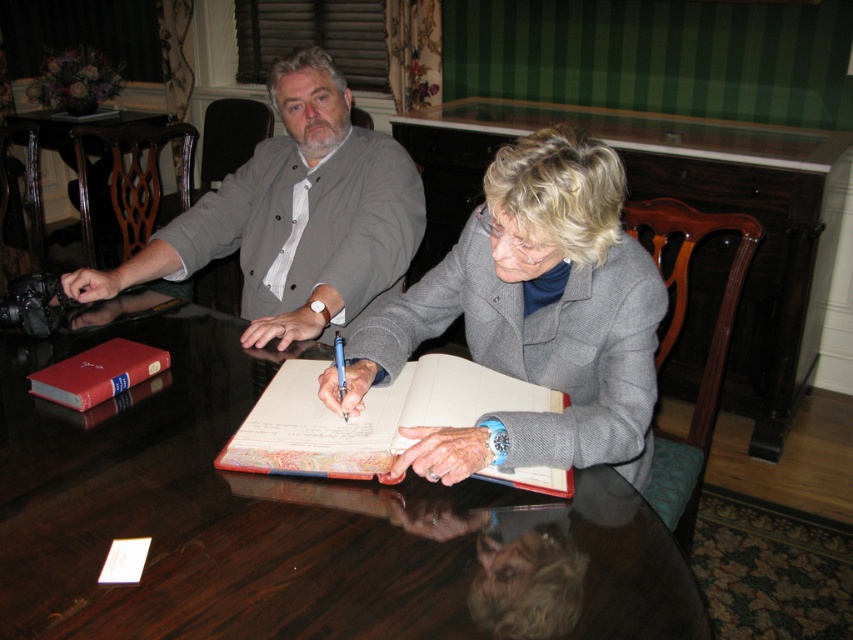
Question: Is glossy wood table at center above wooden table at center?

Choices:
 (A) yes
 (B) no

Answer: (B)

Question: Among these objects, which one is farthest from the camera?

Choices:
 (A) glossy wood table at center
 (B) red leather book at lower left

Answer: (B)

Question: Is gray wool coat at center positioned behind leather-bound book at center?

Choices:
 (A) no
 (B) yes

Answer: (A)

Question: Estimate the real-world distances between objects in this image. Which object is closer to the red leather book at lower left?

Choices:
 (A) gray wool coat at center
 (B) leather-bound book at center

Answer: (B)

Question: Which object appears farthest from the camera in this image?

Choices:
 (A) gray woolen jacket at center
 (B) wooden table at center
 (C) glossy wood table at center

Answer: (B)

Question: Is wooden table at center positioned before red leather book at lower left?

Choices:
 (A) no
 (B) yes

Answer: (A)